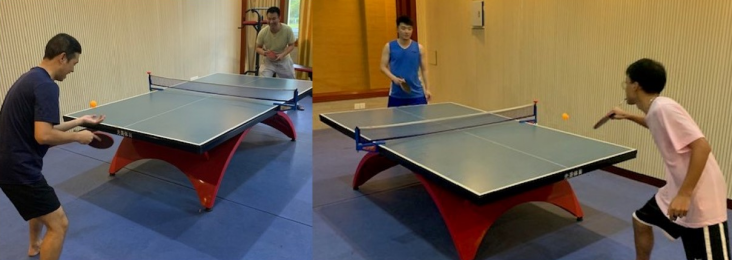
At what (x,y) coordinates should I click in order to perform the action: click on table legs. Please return your answer as a coordinate pair (x, y). Looking at the image, I should click on (206, 203), (111, 173), (294, 139), (351, 188), (463, 248), (580, 221).